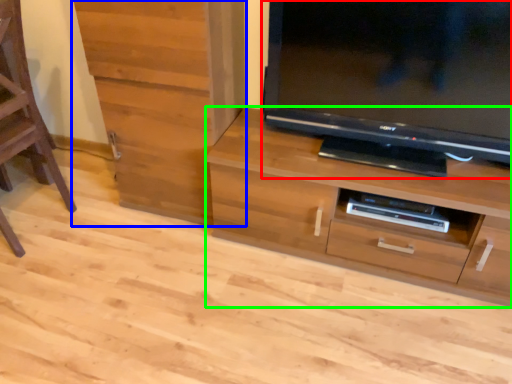
Question: Which is nearer to the television (highlighted by a red box)? cabinetry (highlighted by a blue box) or chest of drawers (highlighted by a green box).

Choices:
 (A) cabinetry
 (B) chest of drawers

Answer: (B)